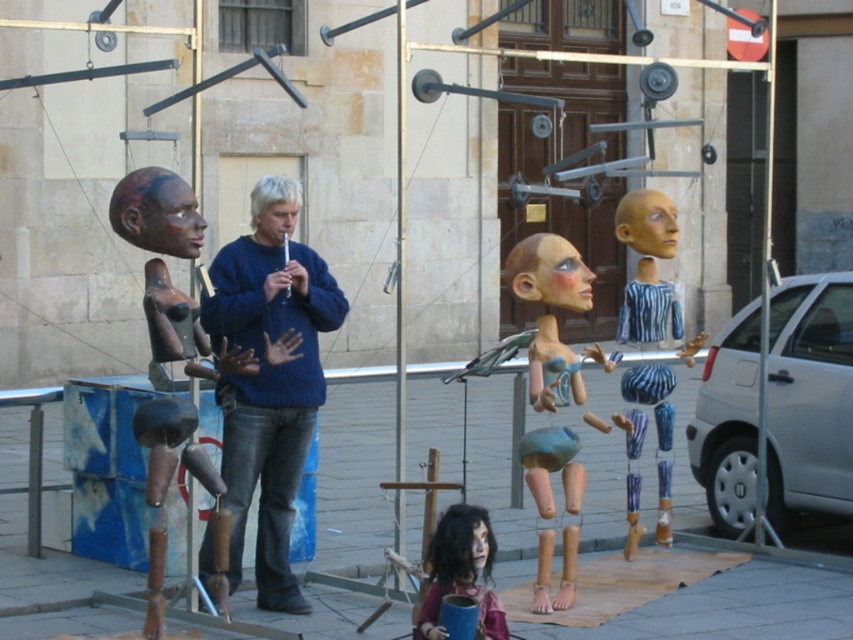
You are an artist trying to sketch the scene. You notice the blue sweater at center and the matte brown hair at center. Which one should you draw first if you want to capture the taller object first?

The blue sweater at center is taller than the matte brown hair at center, so you should draw the blue sweater at center first.

Consider the image. You are an artist trying to sketch the scene. You notice the blue sweater at center and the wooden doll at center. Which object should you draw first if you want to capture the tallest object first?

The blue sweater at center is taller than the wooden doll at center, so you should draw the blue sweater at center first.

You are a photographer trying to capture a clear shot of both the blue sweater at center and the wooden doll at center. Since you want both subjects in focus, which one should you adjust your camera focus to prioritize based on their positions?

You should prioritize focusing on the blue sweater at center because it is closer to the viewer than the wooden doll at center, ensuring both are in focus when using depth of field appropriately.